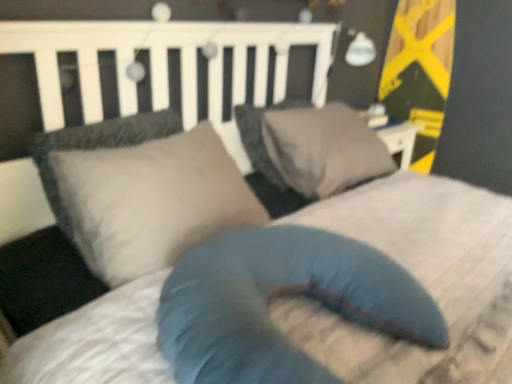
Question: Is gray fabric pillow at center, which is the first pillow in back-to-front order, in front of or behind matte gray pillow at center, which appears as the 2th pillow when viewed from the back, in the image?

Choices:
 (A) front
 (B) behind

Answer: (B)

Question: From the image's perspective, relative to matte gray pillow at center, the 2th pillow from the front, is gray fabric pillow at center, which is the first pillow in back-to-front order, above or below?

Choices:
 (A) below
 (B) above

Answer: (B)

Question: Which object is the farthest from the gray fabric pillow at center, which appears as the third pillow when viewed from the front?

Choices:
 (A) blue fabric pillow at center, which is the first pillow in front-to-back order
 (B) matte gray pillow at center, the 2th pillow from the front

Answer: (A)

Question: Considering the real-world distances, which object is closest to the matte gray pillow at center, which appears as the 2th pillow when viewed from the back?

Choices:
 (A) blue fabric pillow at center, the 3th pillow from the back
 (B) gray fabric pillow at center, which appears as the third pillow when viewed from the front

Answer: (A)